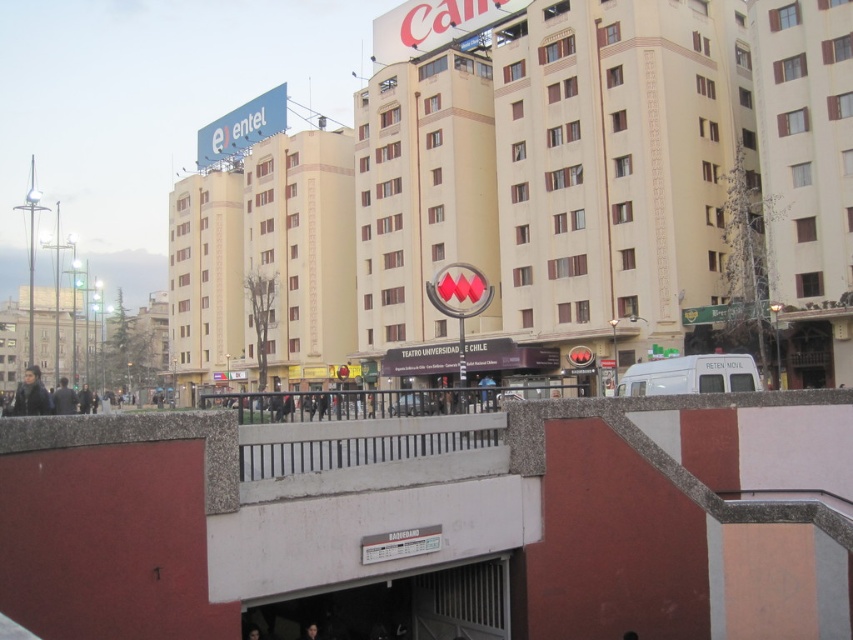
You are standing at the point marked by coordinates point (543, 202) in an urban area. What structure are you most likely standing on?

The point (543, 202) corresponds to the beige concrete building at center, so you are most likely standing on the beige concrete building at center.

You are a pedestrian standing on the overpass in the image. You see a person wearing a dark brown leather jacket at lower left and another person with dark hair at lower center. Which person is closer to the left side of the overpass?

The dark brown leather jacket at lower left is closer to the left side of the overpass because it is positioned to the left of the dark hair at lower center.

You are a photographer planning to take a picture of the beige concrete building at center and the dark hair at lower center. Which object should you focus on first if you want to capture both in a single frame without moving the camera?

The beige concrete building at center is bigger than dark hair at lower center, so you should focus on the beige concrete building at center first to ensure it is in sharp focus while the dark hair at lower center will still be in the frame due to its smaller size.